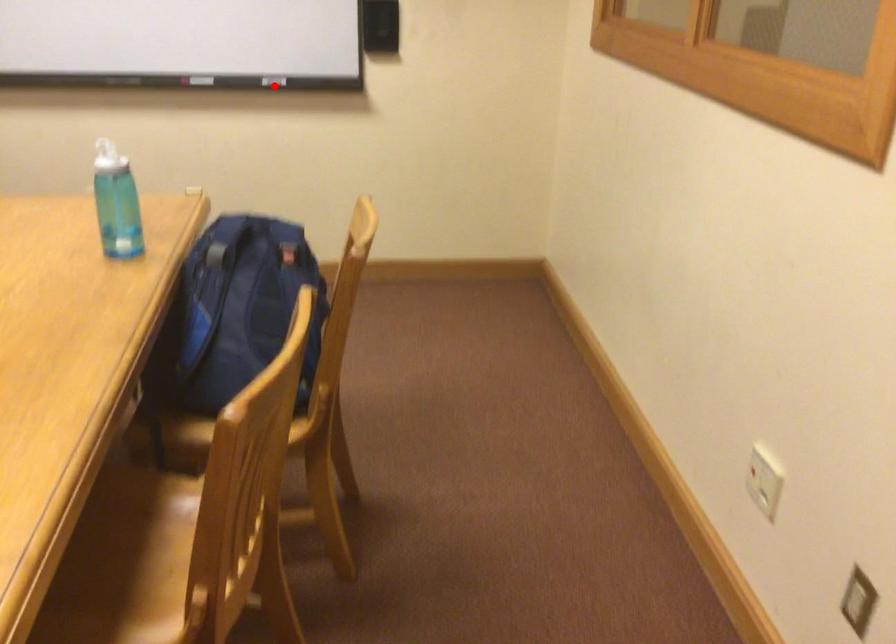
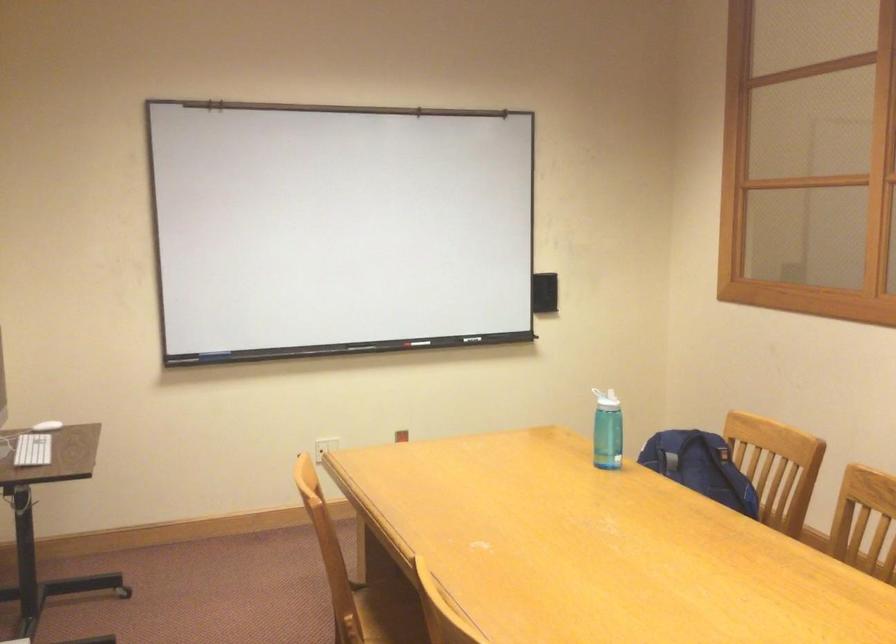
Question: I am providing you with two images of the same scene from different viewpoints. Given a red point in image1, look at the same physical point in image2. Is it:

Choices:
 (A) Closer to the viewpoint
 (B) Farther from the viewpoint

Answer: (B)